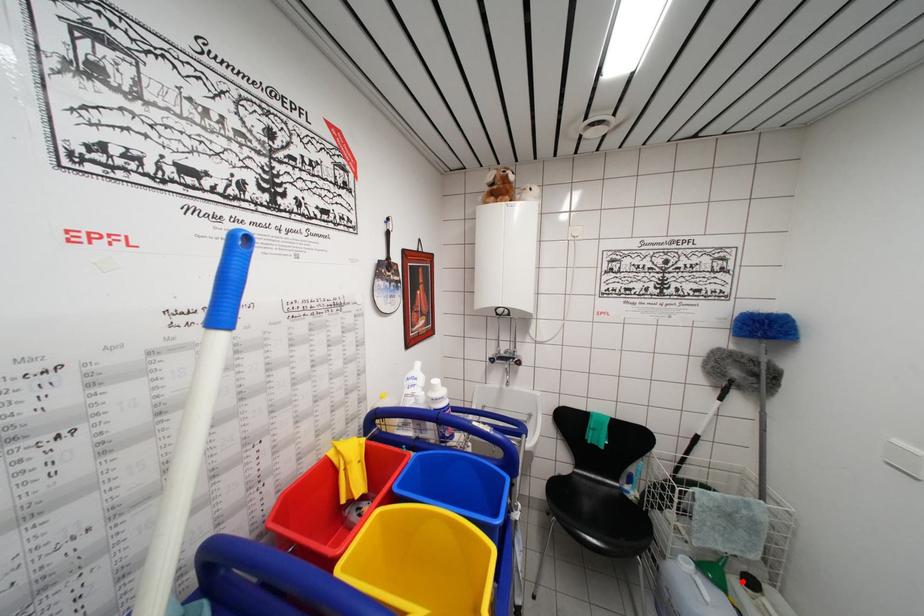
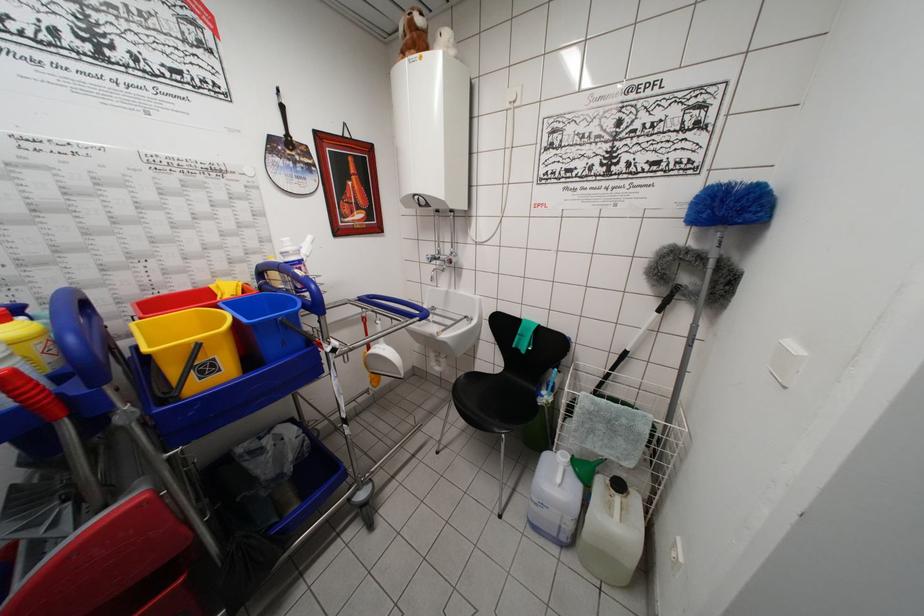
Question: I am providing you with two images of the same scene from different viewpoints. Given a red point in image1, look at the same physical point in image2. Is it:

Choices:
 (A) Closer to the viewpoint
 (B) Farther from the viewpoint

Answer: (B)